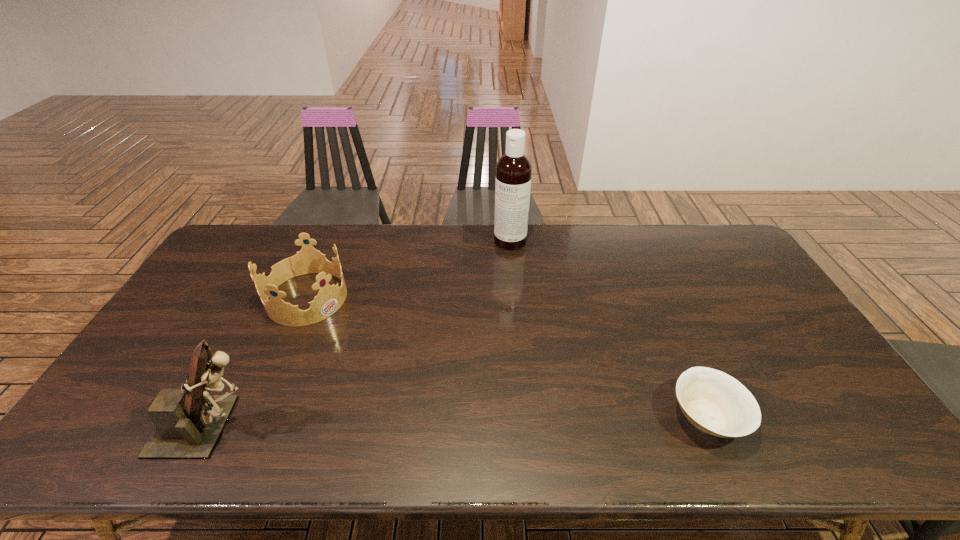
Find the location of a particular element. The width and height of the screenshot is (960, 540). free area in between the tiara and the rightmost object is located at coordinates (507, 357).

Where is `blank region between the third shortest object and the bowl`? This screenshot has height=540, width=960. blank region between the third shortest object and the bowl is located at coordinates (460, 422).

At what (x,y) coordinates should I click in order to perform the action: click on vacant space that is in between the third nearest object and the shortest object. Please return your answer as a coordinate pair (x, y). Looking at the image, I should click on (507, 357).

Locate an element on the screen. This screenshot has height=540, width=960. vacant space that is in between the tiara and the shortest object is located at coordinates (507, 357).

Locate an element on the screen. object that ranks as the third closest to the figurine is located at coordinates (714, 402).

Locate which object is the second closest to the tiara. Please provide its 2D coordinates. Your answer should be formatted as a tuple, i.e. [(x, y)], where the tuple contains the x and y coordinates of a point satisfying the conditions above.

[(513, 169)]

Image resolution: width=960 pixels, height=540 pixels. I want to click on free point that satisfies the following two spatial constraints: 1. on the front side of the second object from right to left; 2. on the right side of the shortest object, so click(x=525, y=417).

Where is `vacant position in the image that satisfies the following two spatial constraints: 1. on the back side of the third object from left to right; 2. on the left side of the tiara`? vacant position in the image that satisfies the following two spatial constraints: 1. on the back side of the third object from left to right; 2. on the left side of the tiara is located at coordinates (331, 241).